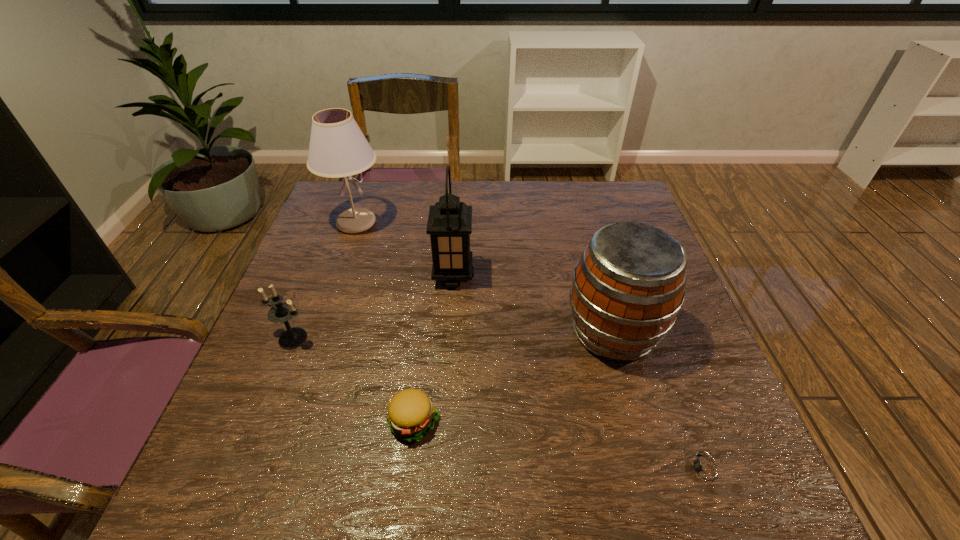
Where is `vacant space located on the right of the second shortest object`? vacant space located on the right of the second shortest object is located at coordinates (588, 421).

Image resolution: width=960 pixels, height=540 pixels. I want to click on vacant area located on the face of the shortest object, so click(x=542, y=469).

Identify the location of vacant region located on the face of the shortest object. click(x=617, y=469).

Identify the location of vacant space located on the face of the shortest object. coord(463,469).

You are a GUI agent. You are given a task and a screenshot of the screen. Output one action in this format:
    pyautogui.click(x=<x>, y=<y>)
    Task: Click on the object that is positioned at the far edge
    This screenshot has width=960, height=540.
    Given the screenshot: What is the action you would take?
    pyautogui.click(x=338, y=148)

Find the location of a particular element. This screenshot has height=540, width=960. object located at the near edge is located at coordinates (705, 470).

At what (x,y) coordinates should I click in order to perform the action: click on lampshade at the left edge. Please return your answer as a coordinate pair (x, y). Looking at the image, I should click on (338, 148).

Identify the location of candle holder located at the left edge. Image resolution: width=960 pixels, height=540 pixels. (282, 312).

Locate an element on the screen. cider present at the right edge is located at coordinates (629, 285).

This screenshot has height=540, width=960. Find the location of `watch that is at the right edge`. watch that is at the right edge is located at coordinates (705, 470).